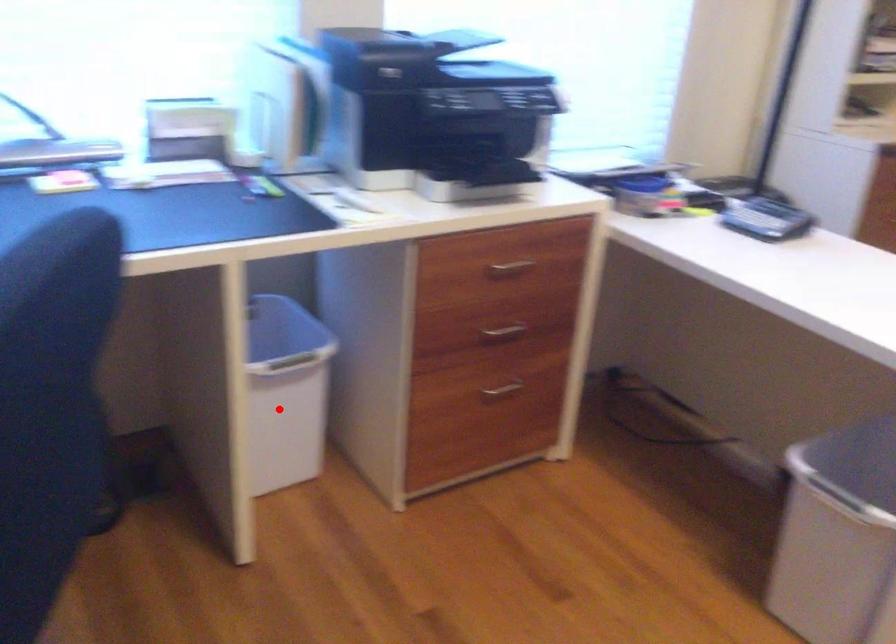
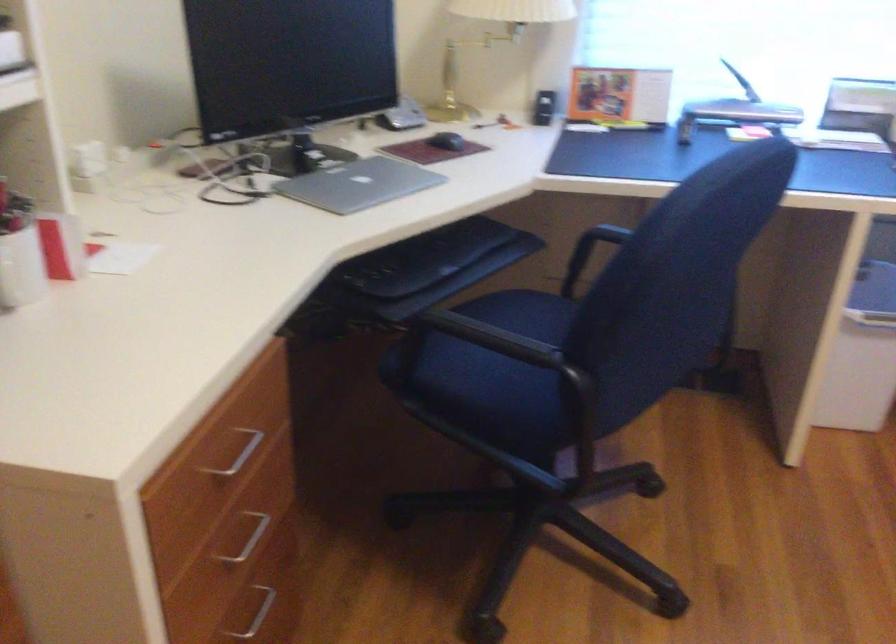
Where in the second image is the point corresponding to the highlighted location from the first image?

(862, 355)